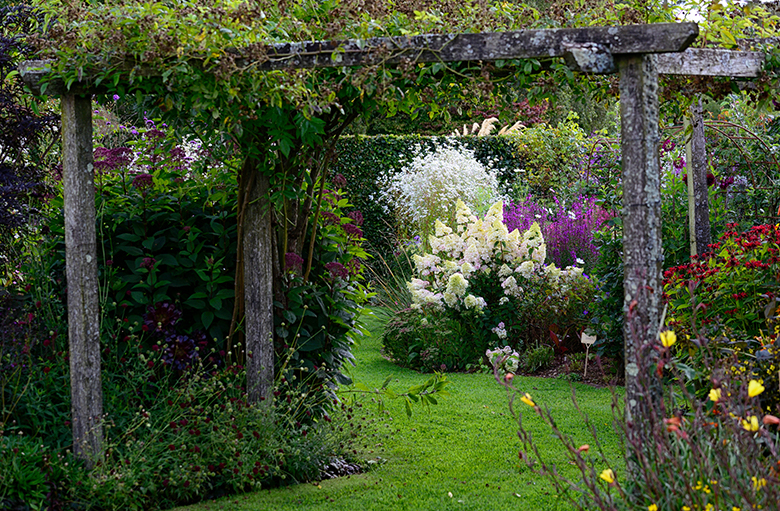
This screenshot has width=780, height=511. I want to click on plant with purple flowers, so click(x=571, y=224).